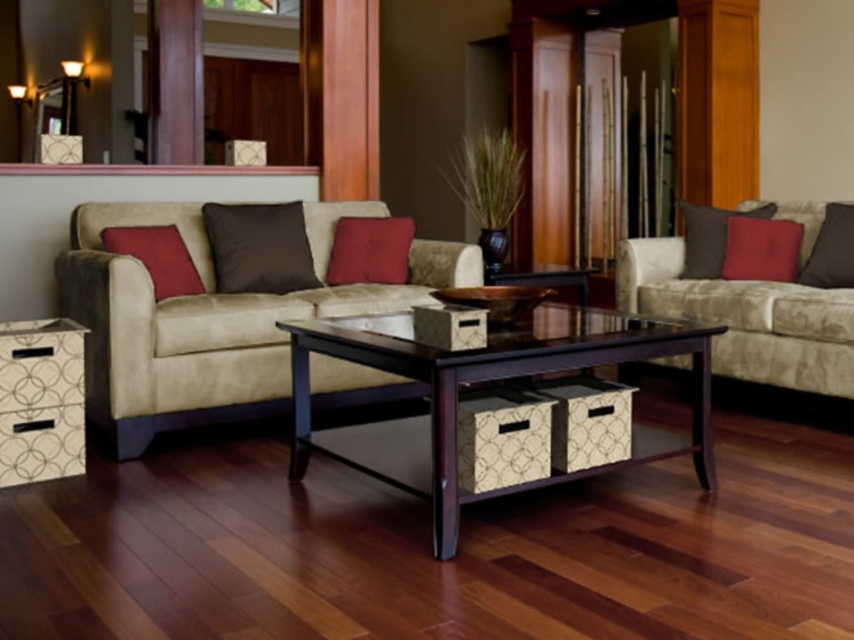
Question: Among these points, which one is farthest from the camera?

Choices:
 (A) (390, 257)
 (B) (133, 240)
 (C) (303, 280)

Answer: (A)

Question: Is matte red pillow at center thinner than matte brown pillow at right?

Choices:
 (A) yes
 (B) no

Answer: (A)

Question: Estimate the real-world distances between objects in this image. Which object is farther from the red suede pillow at left?

Choices:
 (A) matte brown pillow at right
 (B) dark wood/black glass coffee table at center
 (C) matte red pillow at right
 (D) matte red pillow at center

Answer: (C)

Question: Which of these objects is positioned closest to the matte brown pillow at right?

Choices:
 (A) white textured side table at lower left
 (B) suede beige couch at center
 (C) red suede pillow at left
 (D) matte red pillow at center

Answer: (D)

Question: Is suede beige couch at center to the right of satin brown pillow at center from the viewer's perspective?

Choices:
 (A) yes
 (B) no

Answer: (A)

Question: Where is suede beige couch at center located in relation to red suede pillow at left in the image?

Choices:
 (A) left
 (B) right

Answer: (B)